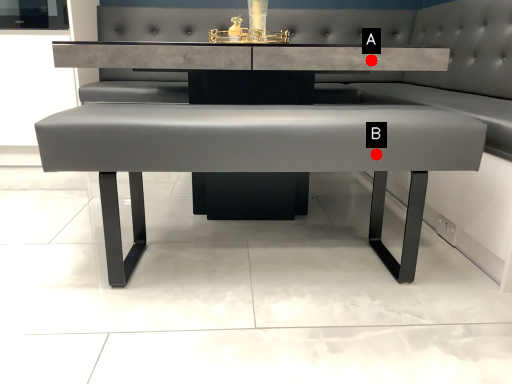
Question: Two points are circled on the image, labeled by A and B beside each circle. Which point is farther to the camera?

Choices:
 (A) A is further
 (B) B is further

Answer: (A)